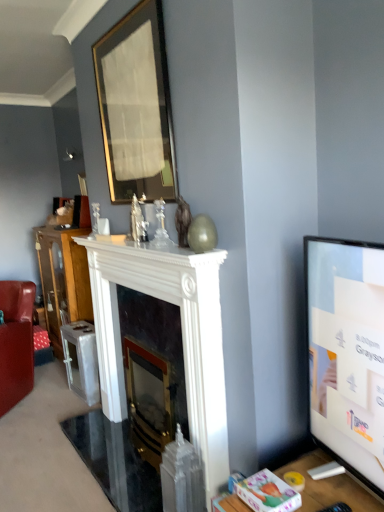
Question: Is white glossy fireplace at center, which appears as the 2th fireplace when viewed from the back, in front of or behind wooden cabinet at left in the image?

Choices:
 (A) front
 (B) behind

Answer: (A)

Question: From their relative heights in the image, would you say white glossy fireplace at center, the 1th fireplace in the front-to-back sequence, is taller or shorter than wooden cabinet at left?

Choices:
 (A) tall
 (B) short

Answer: (B)

Question: Based on their relative distances, which object is nearer to the polished brass fireplace at center, which ranks as the first fireplace in back-to-front order?

Choices:
 (A) matte white vase at center
 (B) wooden cabinet at left
 (C) gold-framed mirror at upper center
 (D) leather armchair at lower left
 (E) flat screen tv at right

Answer: (A)

Question: Which is nearer to the wooden cabinet at left?

Choices:
 (A) white glossy fireplace at center, the 1th fireplace in the front-to-back sequence
 (B) matte white vase at center
 (C) polished brass fireplace at center, which ranks as the first fireplace in back-to-front order
 (D) flat screen tv at right
 (E) gold-framed mirror at upper center

Answer: (A)